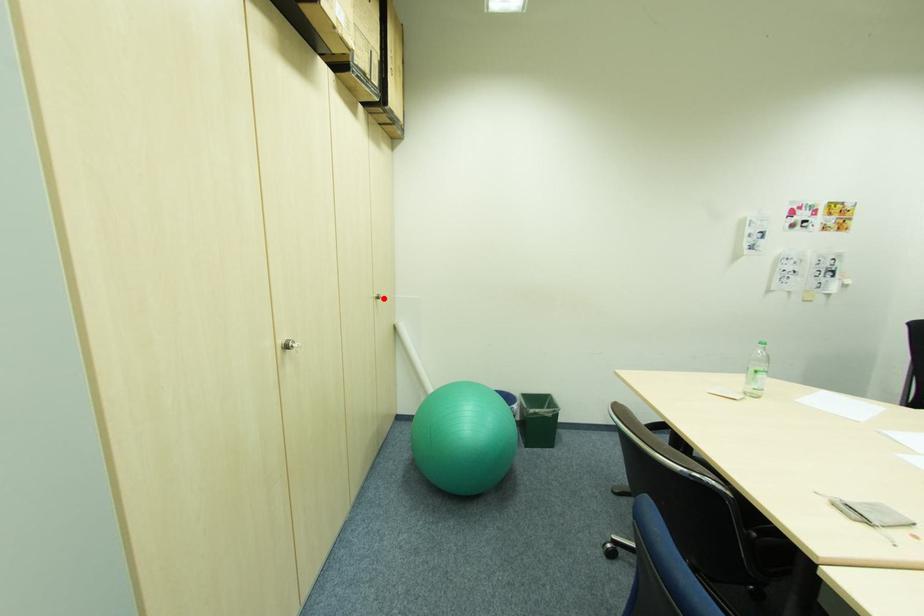
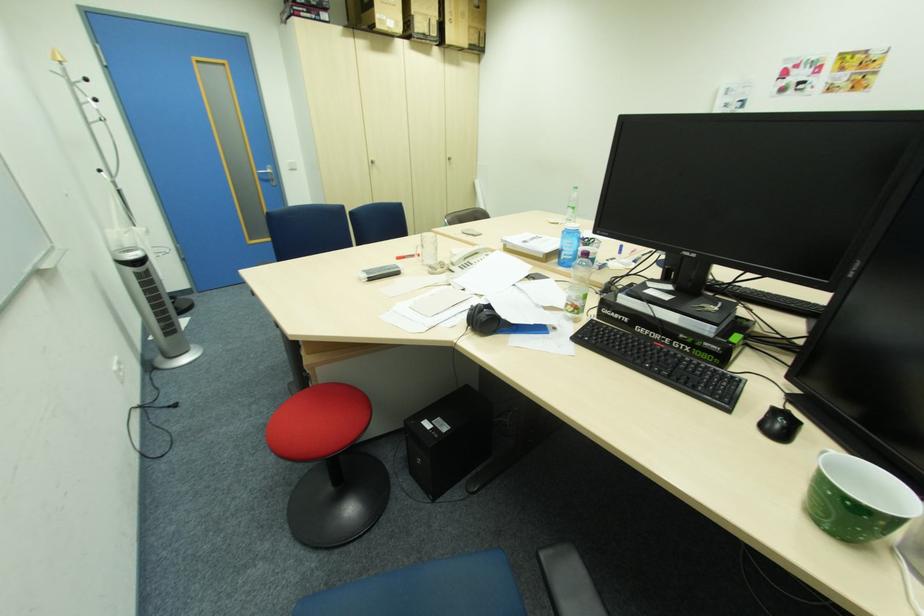
In the second image, find the point that corresponds to the highlighted location in the first image.

(456, 159)